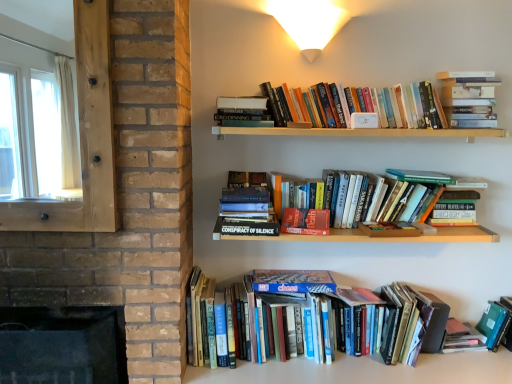
Question: In terms of size, does hardcover book at center right, which is the 2th paperback book in left-to-right order, appear bigger or smaller than hardcover books at lower center, the 2th book when ordered from bottom to top?

Choices:
 (A) big
 (B) small

Answer: (B)

Question: Is hardcover book at center right, marked as the 1th paperback book in a top-to-bottom arrangement, wider or thinner than hardcover books at lower center, the fourth book in the top-to-bottom sequence?

Choices:
 (A) wide
 (B) thin

Answer: (B)

Question: Which object is the closest to the white matte wall sconce at upper center?

Choices:
 (A) hardcover book at center, the second paperback book when ordered from top to bottom
 (B) hardcover book at center, which is counted as the third book, starting from the bottom
 (C) transparent wooden frame at left
 (D) green matte folder at lower right, which is the fifth book from top to bottom
 (E) hardcover books at upper right, the 5th book positioned from the bottom

Answer: (E)

Question: Considering the real-world distances, which object is farthest from the hardcover book at upper center, positioned as the 2th book in top-to-bottom order?

Choices:
 (A) hardcover book at center, which is the 2th paperback book in bottom-to-top order
 (B) hardcover book at lower right, which ranks as the 1th paperback book in right-to-left order
 (C) hardcover book at center, which is counted as the third book, starting from the top
 (D) hardcover book at center right, the third paperback book when ordered from bottom to top
 (E) hardcover books at lower center, the fourth book in the top-to-bottom sequence

Answer: (B)